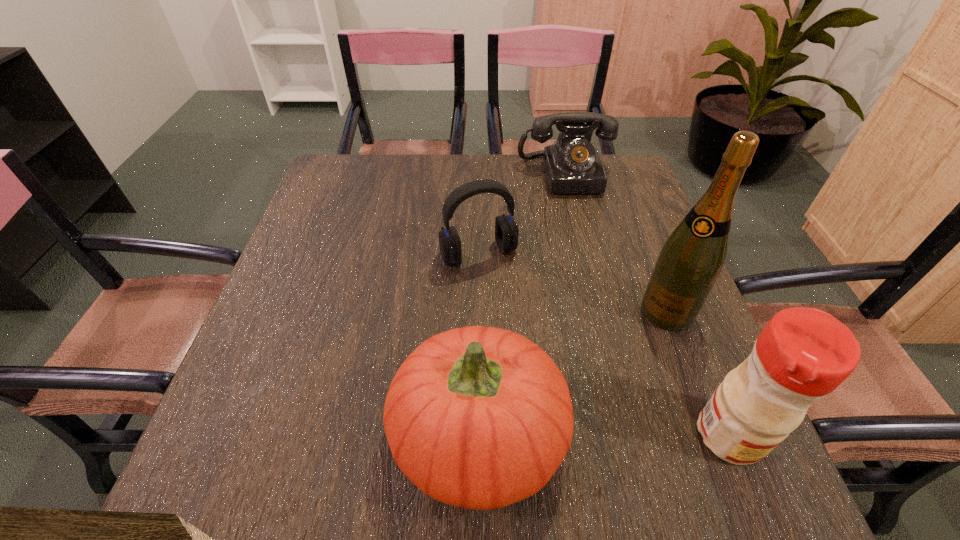
Locate an element on the screen. This screenshot has width=960, height=540. condiment that is at the near edge is located at coordinates (803, 354).

The image size is (960, 540). Find the location of `condiment positioned at the right edge`. condiment positioned at the right edge is located at coordinates (803, 354).

Where is `telephone that is at the right edge`? The height and width of the screenshot is (540, 960). telephone that is at the right edge is located at coordinates (572, 165).

What are the coordinates of `wine bottle at the right edge` in the screenshot? It's located at (690, 261).

The width and height of the screenshot is (960, 540). Identify the location of object located at the far right corner. (572, 165).

Locate an element on the screen. object positioned at the near right corner is located at coordinates (803, 354).

Locate an element on the screen. vacant area at the far edge of the desktop is located at coordinates (396, 164).

The image size is (960, 540). In order to click on free space at the near edge of the desktop in this screenshot , I will do `click(381, 437)`.

This screenshot has width=960, height=540. Find the location of `vacant space at the left edge of the desktop`. vacant space at the left edge of the desktop is located at coordinates (303, 355).

You are a GUI agent. You are given a task and a screenshot of the screen. Output one action in this format:
    pyautogui.click(x=<x>, y=<y>)
    Task: Click on the vacant region at the right edge of the desktop
    Image resolution: width=960 pixels, height=540 pixels.
    Given the screenshot: What is the action you would take?
    pyautogui.click(x=630, y=220)